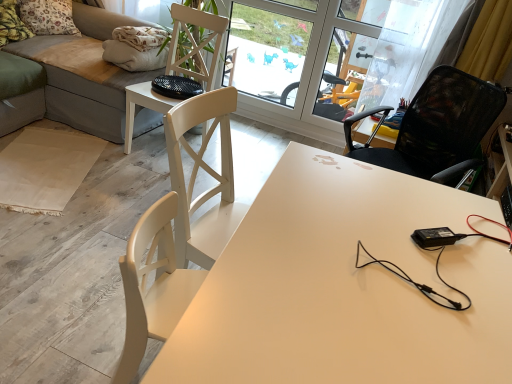
This screenshot has width=512, height=384. Describe the element at coordinates (85, 74) in the screenshot. I see `velvet grey couch at upper left` at that location.

The width and height of the screenshot is (512, 384). What are the coordinates of `floral fabric pillow at upper left, positioned as the second pillow in front-to-back order` in the screenshot? It's located at (48, 17).

This screenshot has width=512, height=384. I want to click on fluffy fabric pillow at upper left, the 2th pillow from the back, so click(11, 24).

What is the approximate width of white wood chair at center, which appears as the second chair when viewed from the right?

white wood chair at center, which appears as the second chair when viewed from the right, is 21.77 inches wide.

The width and height of the screenshot is (512, 384). What do you see at coordinates (437, 127) in the screenshot?
I see `black mesh chair at upper right, arranged as the 2th chair when viewed from the left` at bounding box center [437, 127].

This screenshot has width=512, height=384. What do you see at coordinates (345, 286) in the screenshot?
I see `white matte desk at center` at bounding box center [345, 286].

Describe the element at coordinates (302, 70) in the screenshot. I see `transparent glass screen door at upper center` at that location.

Image resolution: width=512 pixels, height=384 pixels. In order to click on velvet grey couch at upper left in this screenshot , I will do `click(85, 74)`.

Between transparent glass window at center and white matte desk at center, which one appears on the right side from the viewer's perspective?

white matte desk at center.

Considering the sizes of transparent glass window at center and white matte desk at center in the image, is transparent glass window at center taller or shorter than white matte desk at center?

transparent glass window at center is taller than white matte desk at center.

Where is `desk on the right side of transparent glass window at center`? desk on the right side of transparent glass window at center is located at coordinates (345, 286).

From the image's perspective, who appears lower, transparent glass window at center or white matte desk at center?

white matte desk at center appears lower in the image.

Can you confirm if velvet grey couch at upper left is wider than transparent glass screen door at upper center?

Yes, velvet grey couch at upper left is wider than transparent glass screen door at upper center.

Is velvet grey couch at upper left spatially inside transparent glass screen door at upper center, or outside of it?

velvet grey couch at upper left is outside transparent glass screen door at upper center.

Considering the relative positions of velvet grey couch at upper left and transparent glass screen door at upper center in the image provided, is velvet grey couch at upper left to the left of transparent glass screen door at upper center from the viewer's perspective?

Correct, you'll find velvet grey couch at upper left to the left of transparent glass screen door at upper center.

From a real-world perspective, is velvet grey couch at upper left above or below transparent glass screen door at upper center?

velvet grey couch at upper left is situated lower than transparent glass screen door at upper center in the real world.

Consider the image. Is transparent glass window at center inside or outside of transparent glass screen door at upper center?

transparent glass window at center is contained in transparent glass screen door at upper center.

Is transparent glass window at center directly adjacent to transparent glass screen door at upper center?

No, transparent glass window at center is not making contact with transparent glass screen door at upper center.

Between transparent glass window at center and transparent glass screen door at upper center, which one appears on the right side from the viewer's perspective?

transparent glass window at center.

Between transparent glass window at center and transparent glass screen door at upper center, which one has smaller size?

Smaller between the two is transparent glass window at center.

Find the location of a particular element. Image resolution: width=512 pixels, height=384 pixels. chair that is the 1st one when counting rightward from the fluffy fabric pillow at upper left, the 2th pillow from the back is located at coordinates (196, 43).

From the image's perspective, is fluffy fabric pillow at upper left, the 2th pillow from the back, positioned above or below white wood chair at center, which is the first chair in left-to-right order?

From the image's perspective, fluffy fabric pillow at upper left, the 2th pillow from the back, appears above white wood chair at center, which is the first chair in left-to-right order.

Considering the sizes of objects fluffy fabric pillow at upper left, the 2th pillow from the back, and white wood chair at center, which is the first chair in left-to-right order, in the image provided, who is bigger, fluffy fabric pillow at upper left, the 2th pillow from the back, or white wood chair at center, which is the first chair in left-to-right order,?

With larger size is white wood chair at center, which is the first chair in left-to-right order.

Consider the image. From a real-world perspective, between fluffy fabric pillow at upper left, positioned as the first pillow in front-to-back order, and white wood chair at center, which appears as the second chair when viewed from the right, who is vertically higher?

From a 3D spatial view, fluffy fabric pillow at upper left, positioned as the first pillow in front-to-back order, is above.

Is floral fabric pillow at upper left, which appears as the first pillow when viewed from the back, inside white matte desk at center?

Definitely not — floral fabric pillow at upper left, which appears as the first pillow when viewed from the back, is not inside white matte desk at center.

From the image's perspective, is white matte desk at center above floral fabric pillow at upper left, positioned as the second pillow in front-to-back order?

No, from the image's perspective, white matte desk at center is not on top of floral fabric pillow at upper left, positioned as the second pillow in front-to-back order.

Considering the relative sizes of white matte desk at center and floral fabric pillow at upper left, positioned as the second pillow in front-to-back order, in the image provided, is white matte desk at center thinner than floral fabric pillow at upper left, positioned as the second pillow in front-to-back order,?

In fact, white matte desk at center might be wider than floral fabric pillow at upper left, positioned as the second pillow in front-to-back order.

Is white matte desk at center turned away from floral fabric pillow at upper left, positioned as the second pillow in front-to-back order?

white matte desk at center is not turned away from floral fabric pillow at upper left, positioned as the second pillow in front-to-back order.

Is white matte desk at center at the right side of white wood chair at center, which is the first chair in left-to-right order?

Yes, white matte desk at center is to the right of white wood chair at center, which is the first chair in left-to-right order.

From the image's perspective, is white matte desk at center located above or below white wood chair at center, which appears as the second chair when viewed from the right?

white matte desk at center is below white wood chair at center, which appears as the second chair when viewed from the right.

Does white matte desk at center have a greater height compared to white wood chair at center, which is the first chair in left-to-right order?

No.

There is a transparent glass window at center. What are the coordinates of `the 2nd chair below it (from the image's perspective)` in the screenshot? It's located at (437, 127).

Is transparent glass window at center aimed at black mesh chair at upper right, the 1th chair in the right-to-left sequence?

No, transparent glass window at center does not turn towards black mesh chair at upper right, the 1th chair in the right-to-left sequence.

Is transparent glass window at center in front of black mesh chair at upper right, the 1th chair in the right-to-left sequence?

That is False.

Locate an element on the screen. window that appears on the left of white matte desk at center is located at coordinates (267, 53).

Where is `screen door that is above the velvet grey couch at upper left (from the image's perspective)`? This screenshot has height=384, width=512. screen door that is above the velvet grey couch at upper left (from the image's perspective) is located at coordinates (302, 70).

When comparing their distances from transparent glass screen door at upper center, does transparent glass window at center or white wood chair at center, which appears as the second chair when viewed from the right, seem further?

white wood chair at center, which appears as the second chair when viewed from the right, is further to transparent glass screen door at upper center.

Looking at the image, which one is located closer to velvet grey couch at upper left, fluffy fabric pillow at upper left, positioned as the first pillow in front-to-back order, or transparent glass screen door at upper center?

fluffy fabric pillow at upper left, positioned as the first pillow in front-to-back order, is positioned closer to the anchor velvet grey couch at upper left.

When comparing their distances from white matte desk at center, does transparent glass window at center or fluffy fabric pillow at upper left, positioned as the first pillow in front-to-back order, seem further?

fluffy fabric pillow at upper left, positioned as the first pillow in front-to-back order, is further to white matte desk at center.

Based on their spatial positions, is floral fabric pillow at upper left, which appears as the first pillow when viewed from the back, or fluffy fabric pillow at upper left, positioned as the first pillow in front-to-back order, closer to white wood chair at center, which appears as the second chair when viewed from the right?

Based on the image, floral fabric pillow at upper left, which appears as the first pillow when viewed from the back, appears to be nearer to white wood chair at center, which appears as the second chair when viewed from the right.

When comparing their distances from floral fabric pillow at upper left, positioned as the second pillow in front-to-back order, does fluffy fabric pillow at upper left, positioned as the first pillow in front-to-back order, or velvet grey couch at upper left seem further?

velvet grey couch at upper left lies further to floral fabric pillow at upper left, positioned as the second pillow in front-to-back order, than the other object.

Estimate the real-world distances between objects in this image. Which object is closer to white wood chair at center, which appears as the second chair when viewed from the right, velvet grey couch at upper left or floral fabric pillow at upper left, positioned as the second pillow in front-to-back order?

velvet grey couch at upper left is closer to white wood chair at center, which appears as the second chair when viewed from the right.

When comparing their distances from black mesh chair at upper right, the 1th chair in the right-to-left sequence, does white matte desk at center or velvet grey couch at upper left seem closer?

white matte desk at center is closer to black mesh chair at upper right, the 1th chair in the right-to-left sequence.

From the image, which object appears to be nearer to velvet grey couch at upper left, white wood chair at center, which appears as the second chair when viewed from the right, or transparent glass screen door at upper center?

The object closer to velvet grey couch at upper left is white wood chair at center, which appears as the second chair when viewed from the right.

I want to click on chair between fluffy fabric pillow at upper left, the 2th pillow from the back, and transparent glass window at center from left to right, so click(x=196, y=43).

The height and width of the screenshot is (384, 512). I want to click on chair situated between fluffy fabric pillow at upper left, positioned as the first pillow in front-to-back order, and transparent glass screen door at upper center from left to right, so click(196, 43).

This screenshot has height=384, width=512. Find the location of `pillow located between fluffy fabric pillow at upper left, positioned as the first pillow in front-to-back order, and transparent glass screen door at upper center in the left-right direction`. pillow located between fluffy fabric pillow at upper left, positioned as the first pillow in front-to-back order, and transparent glass screen door at upper center in the left-right direction is located at coordinates (48, 17).

I want to click on chair located between floral fabric pillow at upper left, positioned as the second pillow in front-to-back order, and transparent glass screen door at upper center in the left-right direction, so (196, 43).